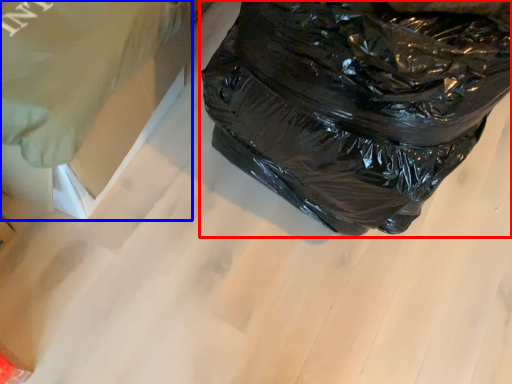
Question: Which object is further to the camera taking this photo, plastic bag (highlighted by a red box) or cardboard box (highlighted by a blue box)?

Choices:
 (A) plastic bag
 (B) cardboard box

Answer: (B)